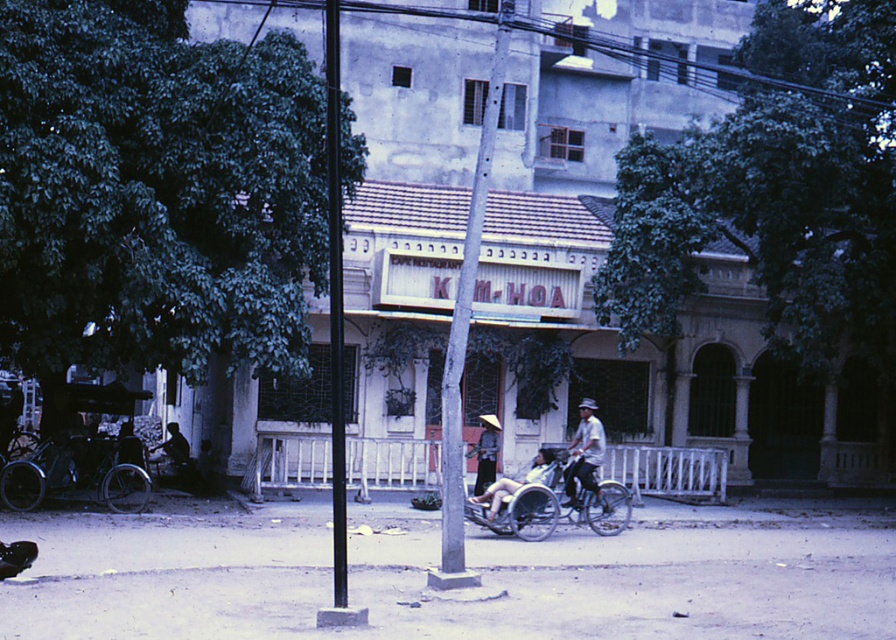
You are a delivery person who needs to park your metallic silver tricycle at lower left next to the matte white hat at center. Will the tricycle fit without overlapping the hat?

The metallic silver tricycle at lower left is wider than the matte white hat at center, so it might not fit without overlapping if placed side by side.

You are a delivery rider who needs to park your bicycle between the matte white hat at center and the silhouette of person at left. Can you fit your bicycle there?

The matte white hat at center is positioned on the right side of silhouette of person at left, so there is space between them. However, the exact width isn not specified, so it depends on the bicycle size.

You are a delivery rider who needs to park your bike near the Kim Hoa building. You see the light brown wooden cart at center and the silhouette of person at left. Which object is closer to the building?

The light brown wooden cart at center is closer to the building because it is located above the silhouette of person at left, indicating it is nearer in the scene.